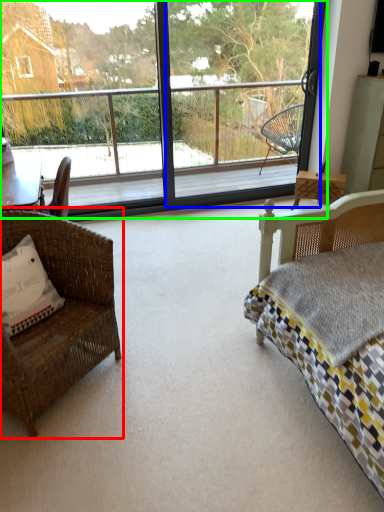
Question: Considering the real-world distances, which object is closest to chair (highlighted by a red box)? screen door (highlighted by a blue box) or window (highlighted by a green box).

Choices:
 (A) screen door
 (B) window

Answer: (B)